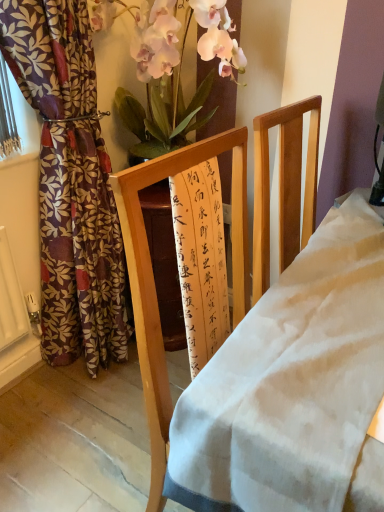
Question: Is point (86, 313) closer or farther from the camera than point (218, 42)?

Choices:
 (A) closer
 (B) farther

Answer: (B)

Question: Is floral-patterned fabric curtain at left in front of or behind silky pink petals at upper center in the image?

Choices:
 (A) behind
 (B) front

Answer: (B)

Question: Based on their relative distances, which object is nearer to the wooden frame at center?

Choices:
 (A) silky pink petals at upper center
 (B) floral-patterned fabric curtain at left

Answer: (B)

Question: Which is nearer to the wooden frame at center?

Choices:
 (A) floral-patterned fabric curtain at left
 (B) silky pink petals at upper center

Answer: (A)